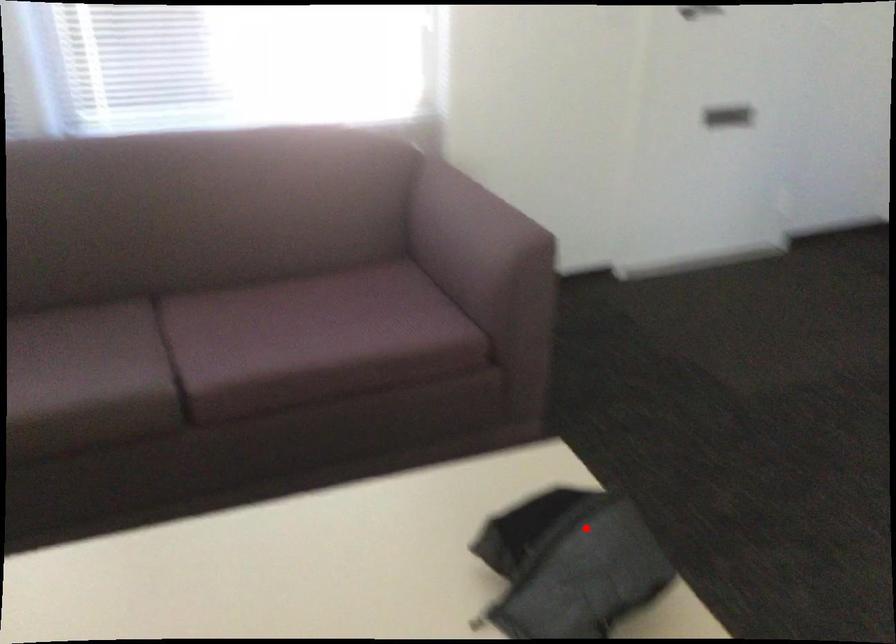
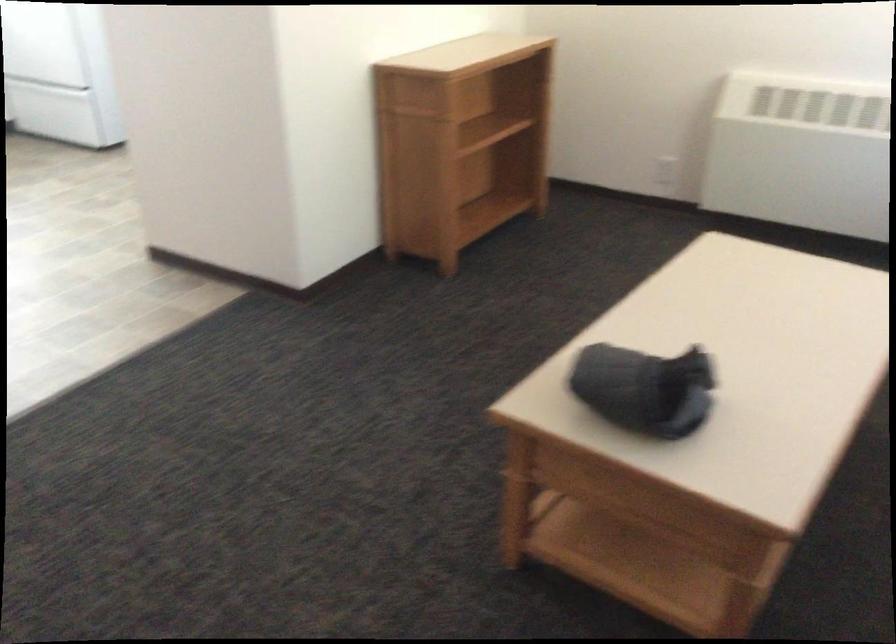
In the second image, find the point that corresponds to the highlighted location in the first image.

(644, 389)